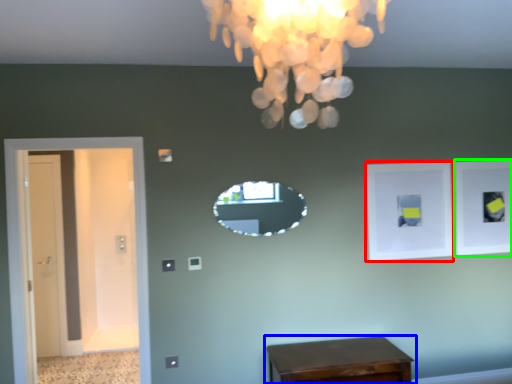
Question: Estimate the real-world distances between objects in this image. Which object is closer to picture frame (highlighted by a red box), table (highlighted by a blue box) or picture frame (highlighted by a green box)?

Choices:
 (A) table
 (B) picture frame

Answer: (B)